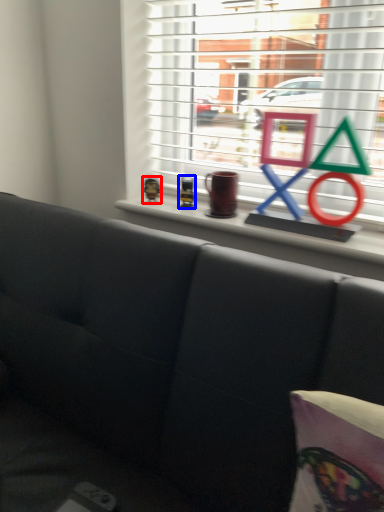
Question: Which object is further to the camera taking this photo, toy (highlighted by a red box) or toy (highlighted by a blue box)?

Choices:
 (A) toy
 (B) toy

Answer: (A)